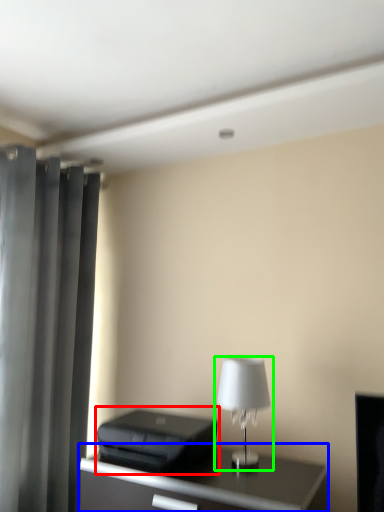
Question: Based on their relative distances, which object is nearer to printer (highlighted by a red box)? Choose from table (highlighted by a blue box) and lamp (highlighted by a green box).

Choices:
 (A) table
 (B) lamp

Answer: (A)